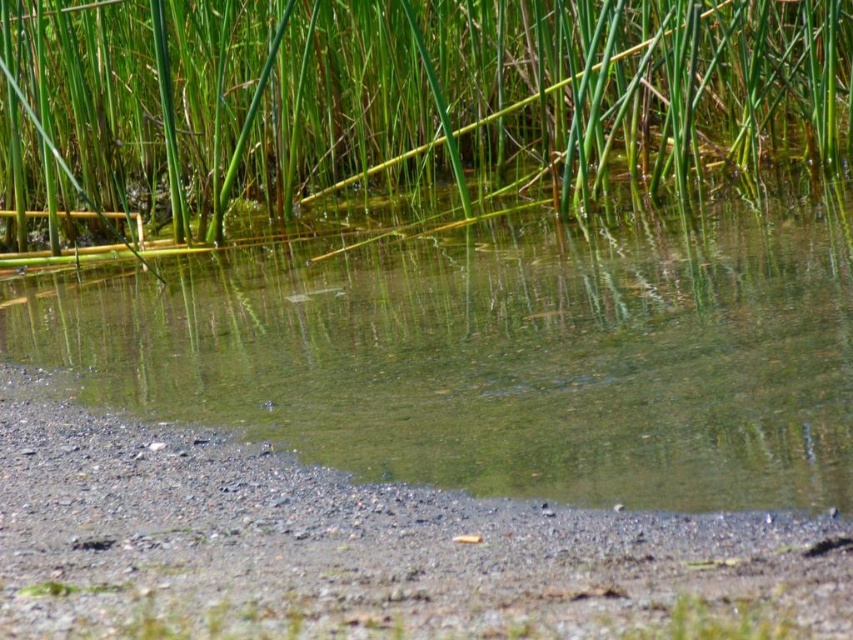
Question: Observing the image, what is the correct spatial positioning of green grass at upper center in reference to gray gravelly mud at bottom?

Choices:
 (A) right
 (B) left

Answer: (A)

Question: Among these points, which one is nearest to the camera?

Choices:
 (A) (850, 371)
 (B) (244, 564)

Answer: (B)

Question: Which of the following is the closest to the observer?

Choices:
 (A) green grass at upper center
 (B) clear water at bottom

Answer: (B)

Question: Does clear water at bottom have a lesser width compared to green grass at upper center?

Choices:
 (A) no
 (B) yes

Answer: (B)

Question: Among these objects, which one is farthest from the camera?

Choices:
 (A) green grass at upper center
 (B) clear water at bottom

Answer: (A)

Question: From the image, what is the correct spatial relationship of clear water at bottom in relation to green grass at upper center?

Choices:
 (A) below
 (B) above

Answer: (A)